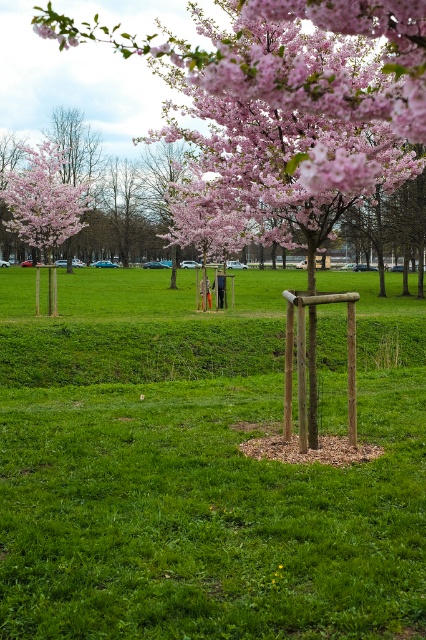
You are a gardener who needs to water both the pink blossom tree at upper center and the pink matte flower at upper center. Your watering can has a maximum reach of 2 meters. Can you water both plants without moving the watering can?

The distance between the pink blossom tree at upper center and the pink matte flower at upper center is 2.25 meters, which exceeds the watering can reach of 2 meters. Therefore, you cannot water both plants without moving the watering can.

You are a gardener planning to plant a new pink blossom tree in the park. You have a space that can accommodate a tree up to the width of the matte pink blossoms at upper left. Can the pink blossom tree at upper center fit in this space?

The pink blossom tree at upper center has a width less than the matte pink blossoms at upper left, so it can fit in the space designed for the matte pink blossoms at upper left.

You are standing at the point with coordinates point (x=48, y=35) and want to walk to the point with coordinates point (x=282, y=26). Is the destination point behind you or in front of you?

The destination point (x=282, y=26) is behind the starting point (x=48, y=35), so it is behind you.